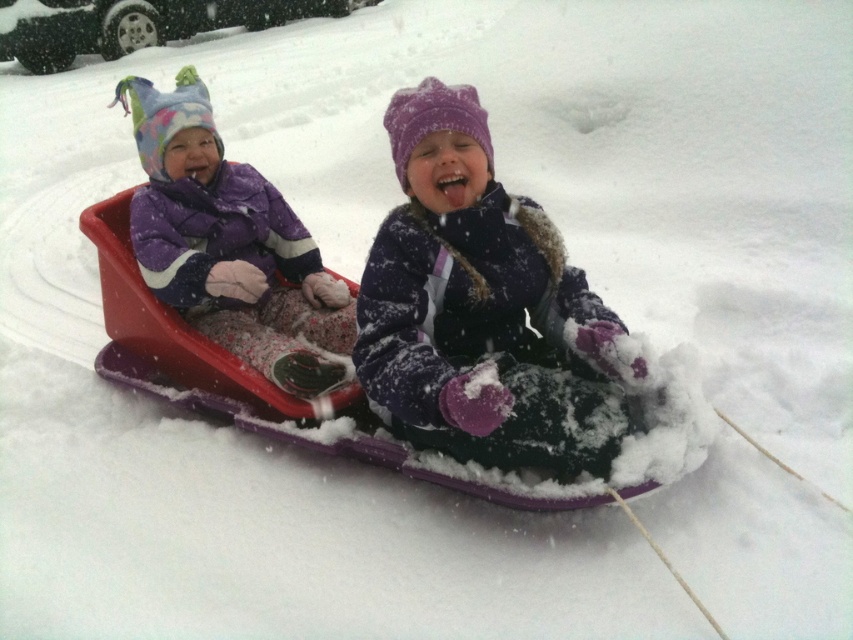
Which is above, purple fuzzy coat at center or matte purple snowsuit at left?

Positioned higher is matte purple snowsuit at left.

Does point (387, 330) come closer to viewer compared to point (305, 332)?

That is True.

Does point (567, 314) lie behind point (254, 296)?

That is False.

You are a GUI agent. You are given a task and a screenshot of the screen. Output one action in this format:
    pyautogui.click(x=<x>, y=<y>)
    Task: Click on the purple fuzzy coat at center
    The height and width of the screenshot is (640, 853).
    Given the screenshot: What is the action you would take?
    (x=479, y=307)